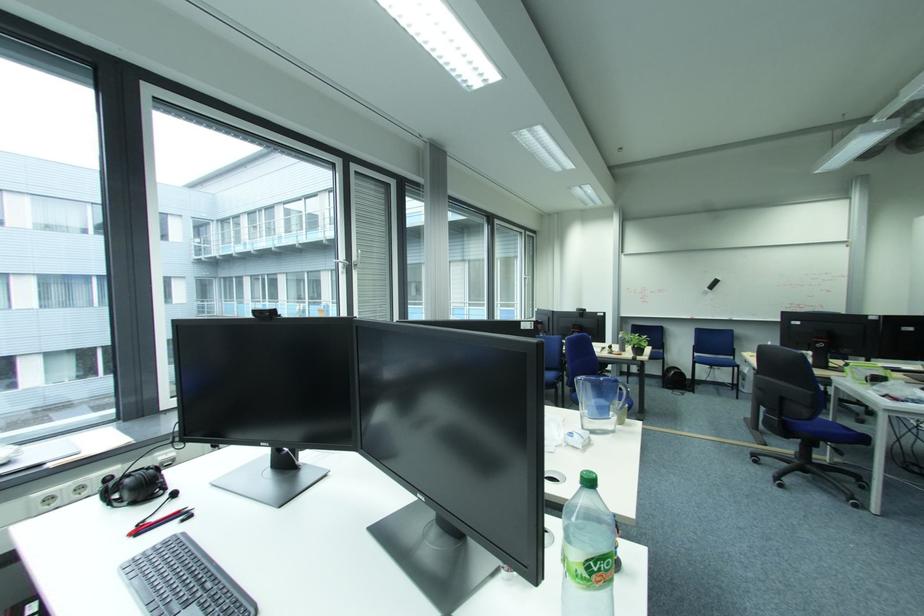
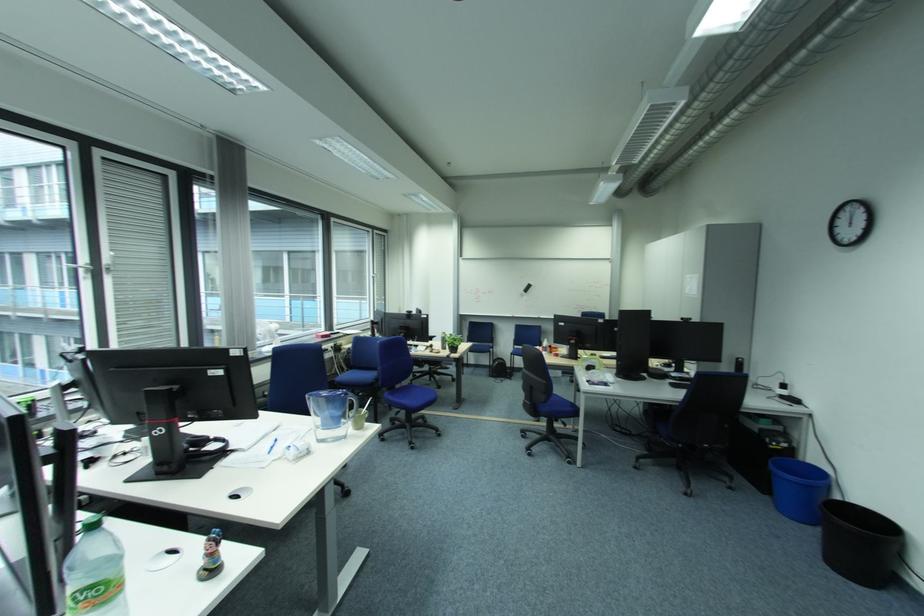
Consider the image. In a continuous first-person perspective shot, in which direction is the camera moving?

Result: The movement direction of the cameraman is right, backward.